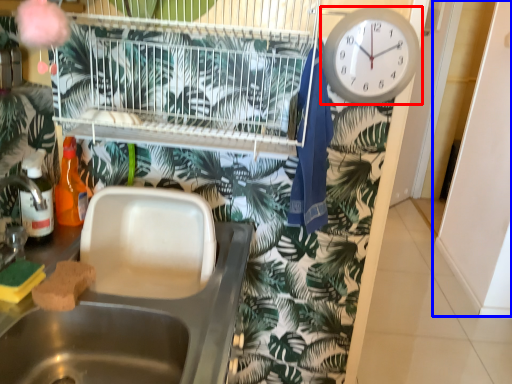
Question: Which of the following is the closest to the observer, wall clock (highlighted by a red box) or screen door (highlighted by a blue box)?

Choices:
 (A) wall clock
 (B) screen door

Answer: (A)